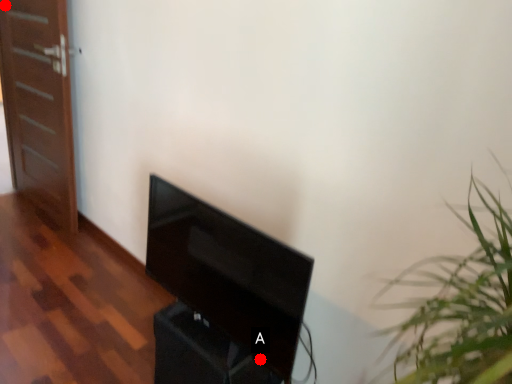
Question: Two points are circled on the image, labeled by A and B beside each circle. Which point appears closest to the camera in this image?

Choices:
 (A) A is closer
 (B) B is closer

Answer: (A)